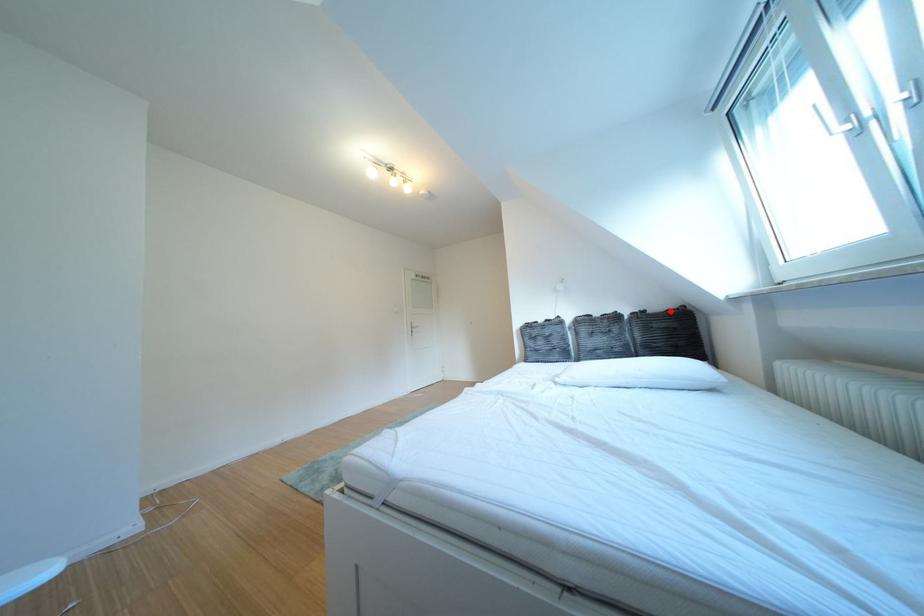
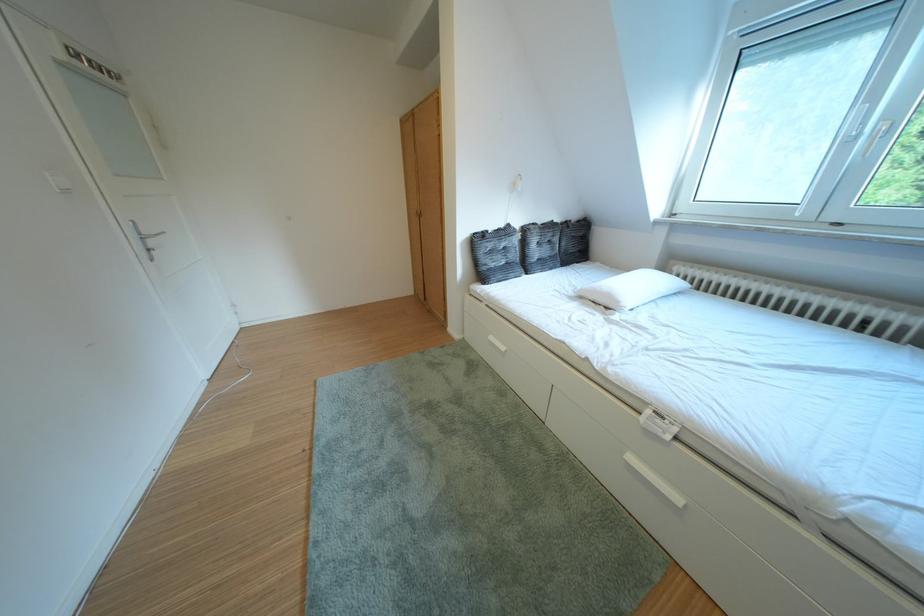
Find the pixel in the second image that matches the highlighted location in the first image.

(588, 222)